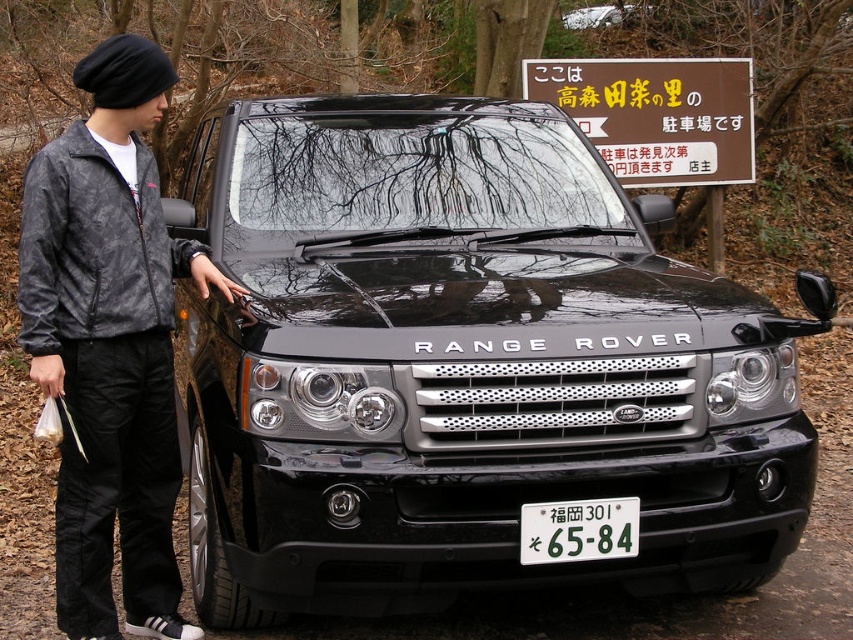
Question: Based on their relative distances, which object is nearer to the black metallic range rover at center?

Choices:
 (A) black metallic car at center
 (B) white plastic license plate at center

Answer: (B)

Question: Is white plastic license plate at center positioned at the back of black metallic car at center?

Choices:
 (A) no
 (B) yes

Answer: (A)

Question: Is white plastic license plate at center positioned before black metallic car at center?

Choices:
 (A) no
 (B) yes

Answer: (B)

Question: Where is black metallic range rover at center located in relation to camouflage jacket at left in the image?

Choices:
 (A) left
 (B) right

Answer: (B)

Question: Which object is the closest to the white plastic license plate at center?

Choices:
 (A) camouflage jacket at left
 (B) black metallic range rover at center

Answer: (B)

Question: Which point is closer to the camera?

Choices:
 (A) (25, 326)
 (B) (323, 417)
 (C) (637, 515)

Answer: (A)